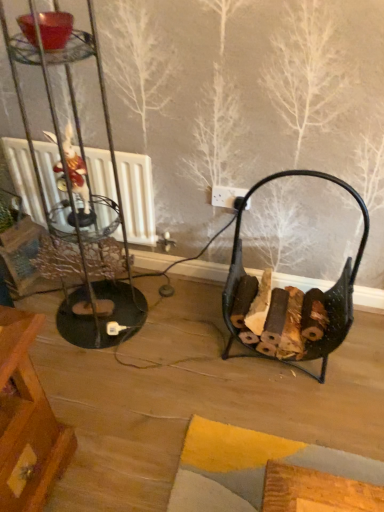
In order to click on vacant space to the right of black metal firewood basket at lower right in this screenshot , I will do `click(359, 356)`.